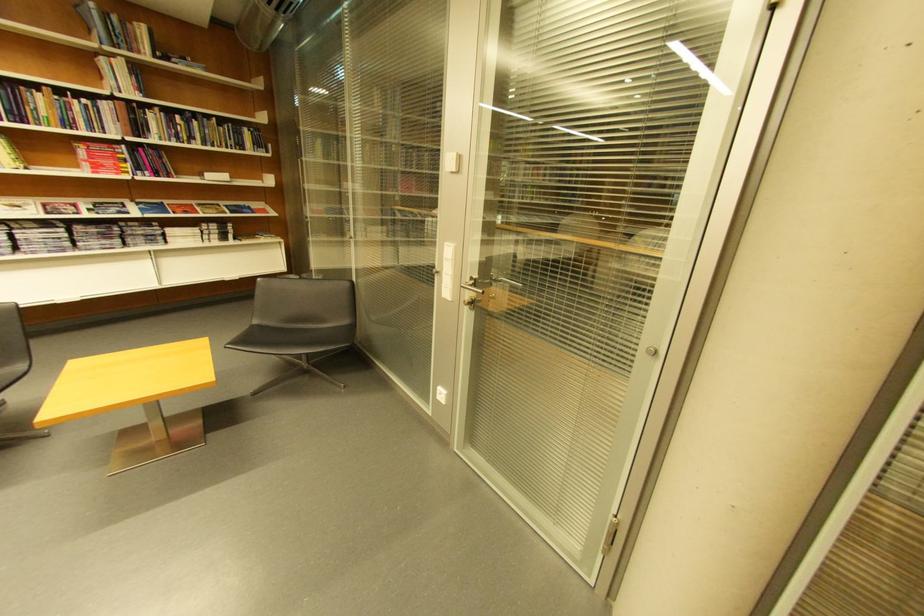
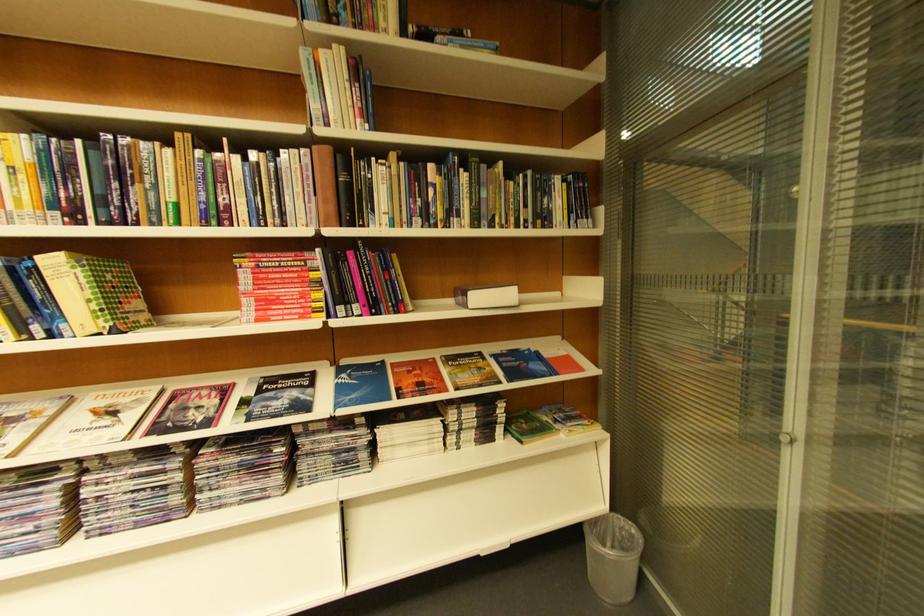
Find the pixel in the second image that matches (x=150, y=54) in the first image.

(384, 31)